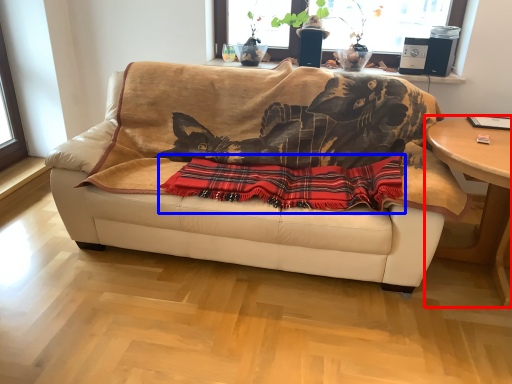
Question: Which point is further to the camera, table (highlighted by a red box) or plaid (highlighted by a blue box)?

Choices:
 (A) table
 (B) plaid

Answer: (B)